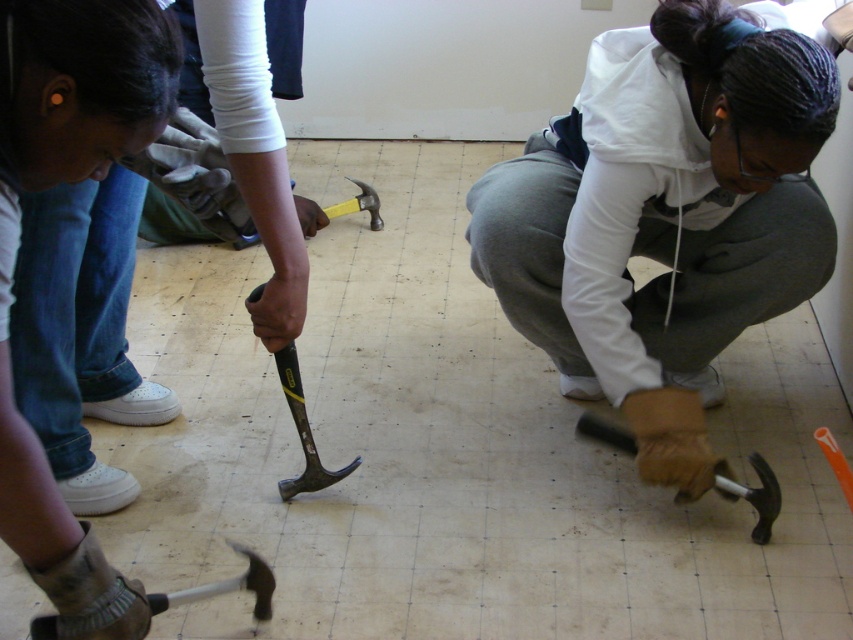
Question: Which object is positioned closest to the matte black hammer at center?

Choices:
 (A) black rubber hammer at center
 (B) silver metallic hammer at lower left
 (C) matte black hammer at lower center
 (D) matte black hammer at lower right

Answer: (A)

Question: Which object appears farthest from the camera in this image?

Choices:
 (A) matte black hammer at center
 (B) black rubber hammer at center
 (C) yellow rubber handle hammer at center

Answer: (A)

Question: Is matte black hammer at lower right smaller than silver metallic hammer at lower left?

Choices:
 (A) no
 (B) yes

Answer: (A)

Question: Is matte black hammer at lower right in front of yellow rubber handle hammer at center?

Choices:
 (A) yes
 (B) no

Answer: (B)

Question: Where is matte black hammer at lower center located in relation to black rubber hammer at center in the image?

Choices:
 (A) right
 (B) left

Answer: (A)

Question: Estimate the real-world distances between objects in this image. Which object is farther from the matte black hammer at lower right?

Choices:
 (A) black rubber hammer at center
 (B) silver metallic hammer at lower left
 (C) matte black hammer at center

Answer: (C)